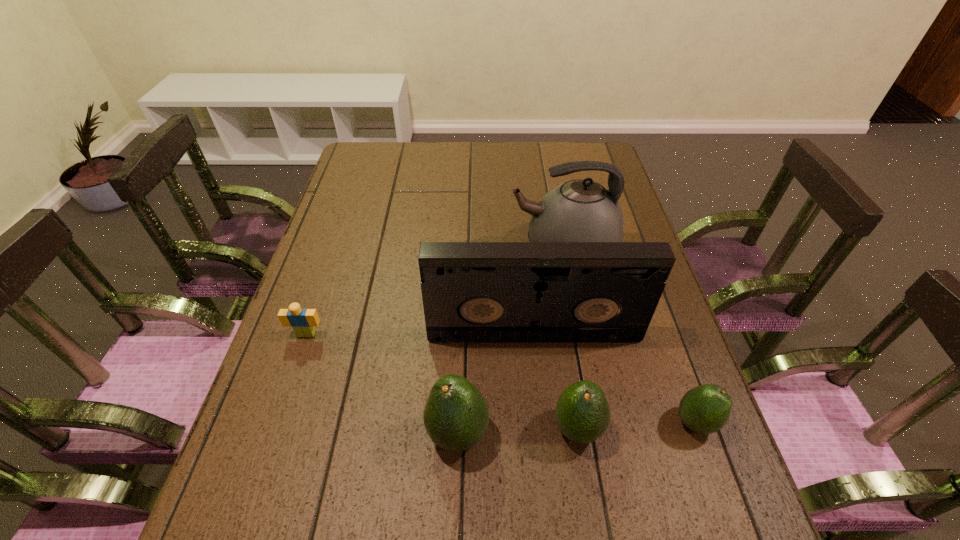
Find the location of a particular element. The width and height of the screenshot is (960, 540). free space that satisfies the following two spatial constraints: 1. on the face of the shortest avocado; 2. on the right side of the leftmost object is located at coordinates (276, 422).

Find the location of `vacant space that satisfies the following two spatial constraints: 1. on the front side of the videotape; 2. on the left side of the rightmost avocado`. vacant space that satisfies the following two spatial constraints: 1. on the front side of the videotape; 2. on the left side of the rightmost avocado is located at coordinates click(x=543, y=422).

At what (x,y) coordinates should I click in order to perform the action: click on vacant space that satisfies the following two spatial constraints: 1. on the front side of the second shortest object; 2. on the right side of the videotape. Please return your answer as a coordinate pair (x, y). This screenshot has width=960, height=540. Looking at the image, I should click on (543, 422).